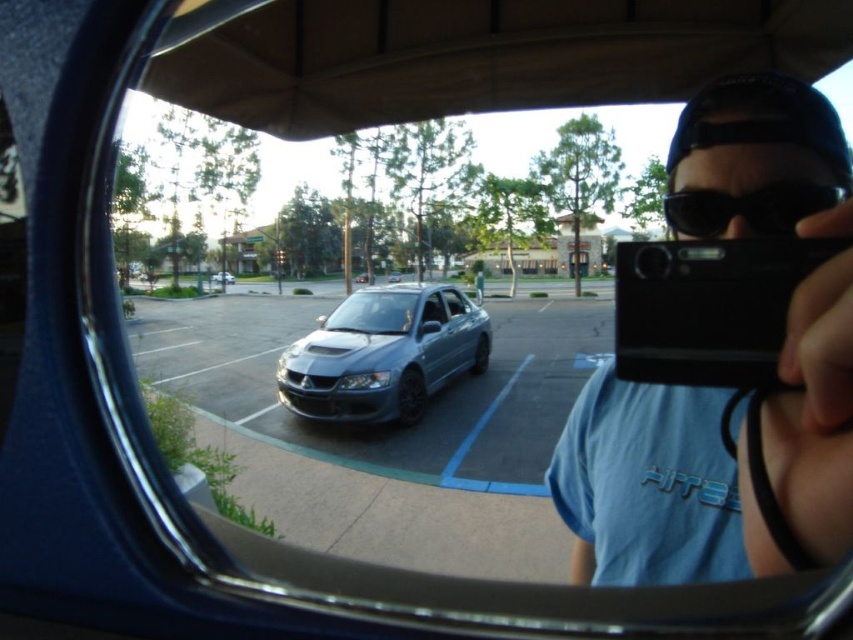
In the scene shown: You are a photographer standing in a parking lot. You want to take a photo of the satin metallic car at center. Your camera is 11.33 feet away from the car. If the recommended distance for sharp photos of cars is at least 10 feet, can you take a clear photo from this distance?

The satin metallic car at center and camera are 11.33 feet apart, which is more than the recommended 10 feet distance. Therefore, you can take a clear photo from this distance.

Based on the photo, you are a photographer trying to capture a clear shot of the satin metallic car at center without any obstructions. Based on the scene, is the black matte goggles at upper right blocking the view of the car?

The satin metallic car at center is positioned under the black matte goggles at upper right, so the goggles are blocking the view of the car.

You are inside a vehicle and looking through a circular mirror. You see two cars reflected in the mirror. The first is a satin metallic car at center, and the second is a satin metallic sedan at center. Which car is closer to you?

The satin metallic car at center is closer to the viewer than the satin metallic sedan at center.